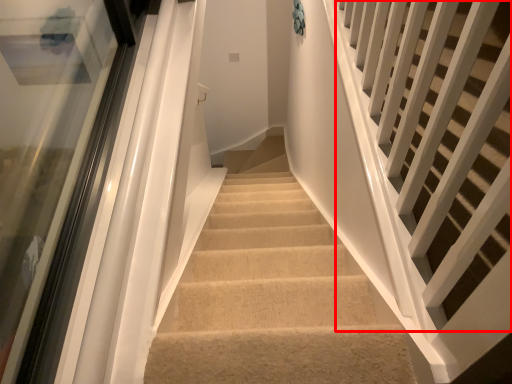
Question: From the image's perspective, where is stairs (annotated by the red box) located relative to glass door?

Choices:
 (A) below
 (B) above

Answer: (B)